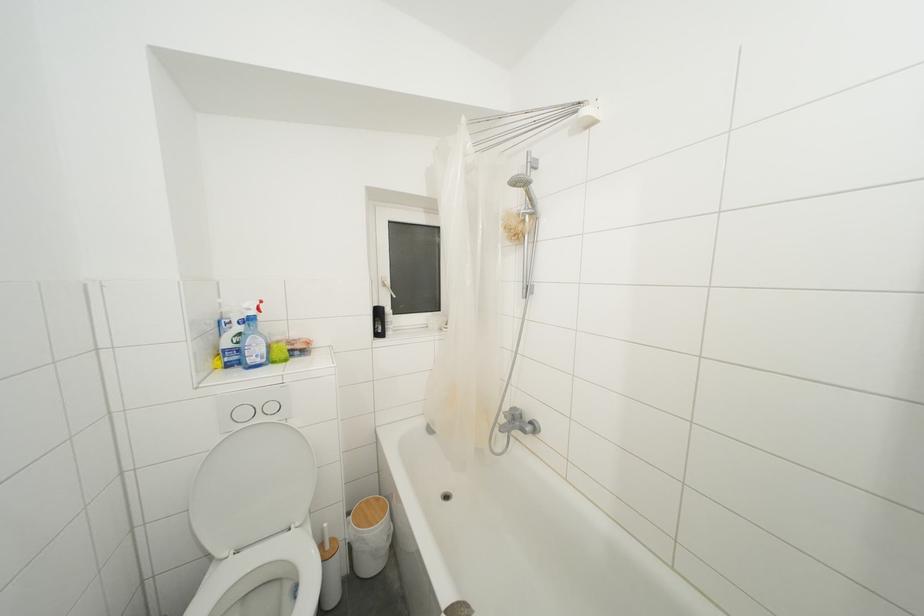
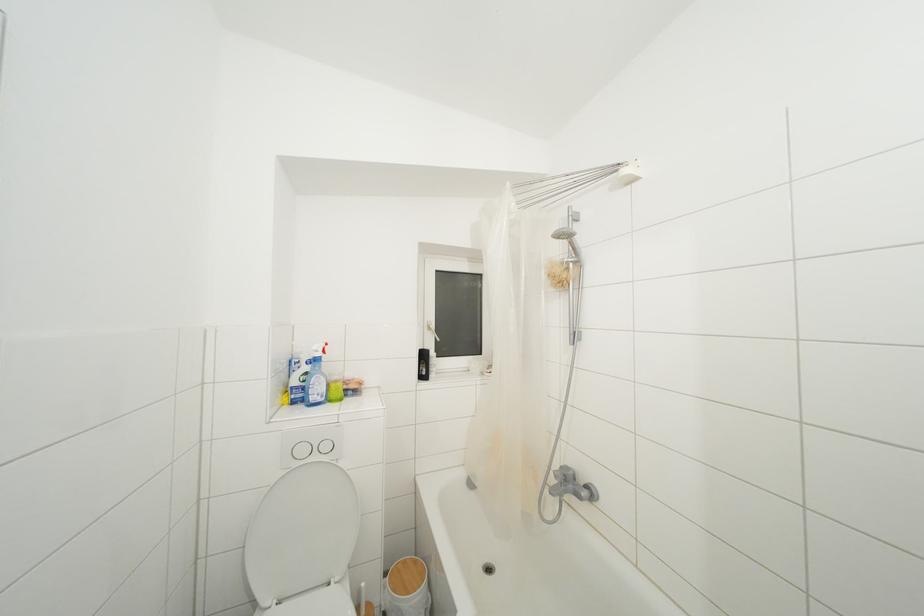
Find the pixel in the second image that matches point 517,419 in the first image.

(568, 480)